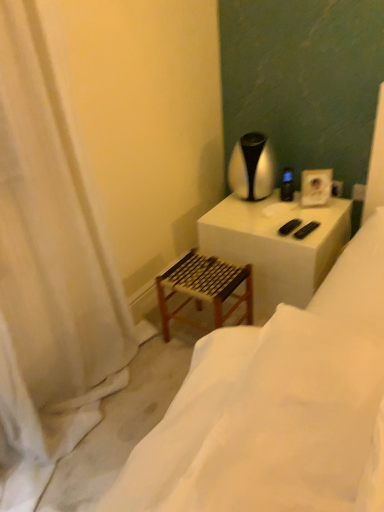
Where is `free spot in front of black plastic remote control at upper right`? free spot in front of black plastic remote control at upper right is located at coordinates coord(299,214).